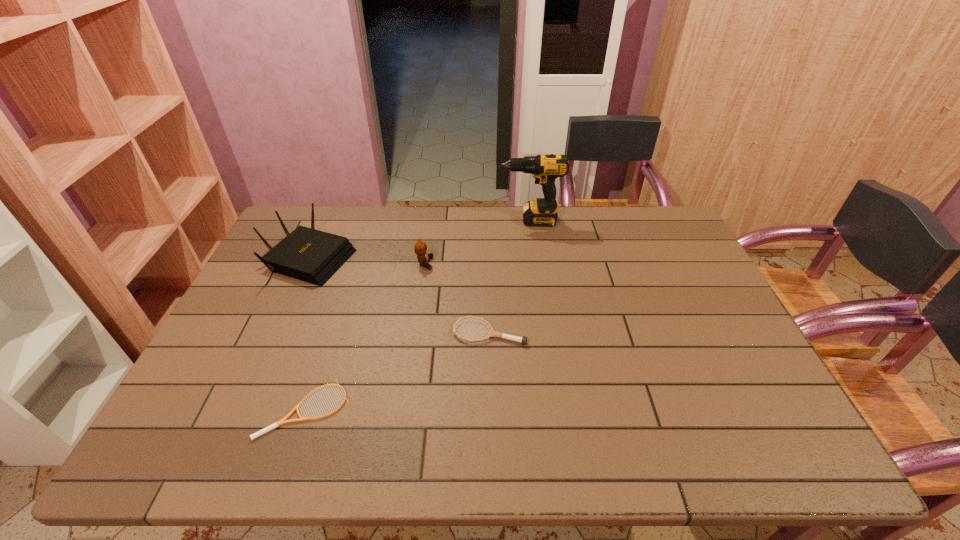
At what (x,y) coordinates should I click in order to perform the action: click on free space located 0.380m at the tip of the drill. Please return your answer as a coordinate pair (x, y). This screenshot has height=540, width=960. Looking at the image, I should click on (394, 221).

Image resolution: width=960 pixels, height=540 pixels. Find the location of `free point located 0.280m at the tip of the drill`. free point located 0.280m at the tip of the drill is located at coordinates (421, 221).

You are a GUI agent. You are given a task and a screenshot of the screen. Output one action in this format:
    pyautogui.click(x=<x>, y=<y>)
    Task: Click on the vacant area located 0.190m on the right of the second tallest object
    The width and height of the screenshot is (960, 540).
    Given the screenshot: What is the action you would take?
    pyautogui.click(x=414, y=256)

Identify the location of free region located on the front-facing side of the third shortest object. (468, 264).

You are a GUI agent. You are given a task and a screenshot of the screen. Output one action in this format:
    pyautogui.click(x=<x>, y=<y>)
    Task: Click on the vacant space situated on the front of the right tennis racket
    
    Given the screenshot: What is the action you would take?
    pyautogui.click(x=492, y=436)

Identify the location of vacant area located 0.310m on the right of the nearer tennis racket. (482, 409).

Find the location of a particular element. This screenshot has height=540, width=960. drill that is at the far edge is located at coordinates (545, 168).

The height and width of the screenshot is (540, 960). In order to click on router present at the far edge in this screenshot , I will do `click(313, 256)`.

Find the location of a particular element. Image resolution: width=960 pixels, height=540 pixels. object located at the near edge is located at coordinates (x=283, y=421).

At what (x,y) coordinates should I click in order to perform the action: click on object that is at the left edge. Please return your answer as a coordinate pair (x, y). Image resolution: width=960 pixels, height=540 pixels. Looking at the image, I should click on point(313,256).